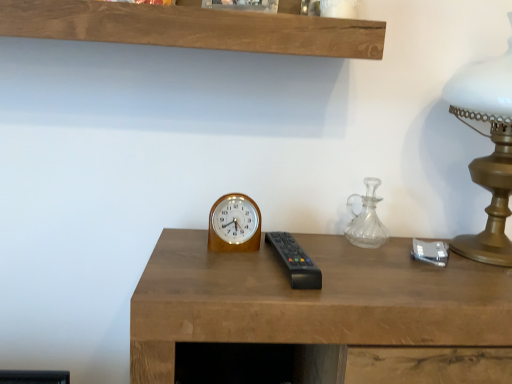
Question: Is wooden wall clock at center taller or shorter than gold metallic table lamp at right?

Choices:
 (A) tall
 (B) short

Answer: (B)

Question: In terms of size, does wooden wall clock at center appear bigger or smaller than gold metallic table lamp at right?

Choices:
 (A) small
 (B) big

Answer: (A)

Question: Which is nearer to the gold metallic table lamp at right?

Choices:
 (A) wooden desk at center
 (B) black plastic remote at center
 (C) clear glass carafe at right
 (D) wooden wall clock at center

Answer: (C)

Question: Which is farther from the black plastic remote at center?

Choices:
 (A) clear glass carafe at right
 (B) wooden wall clock at center
 (C) gold metallic table lamp at right
 (D) wooden desk at center

Answer: (C)